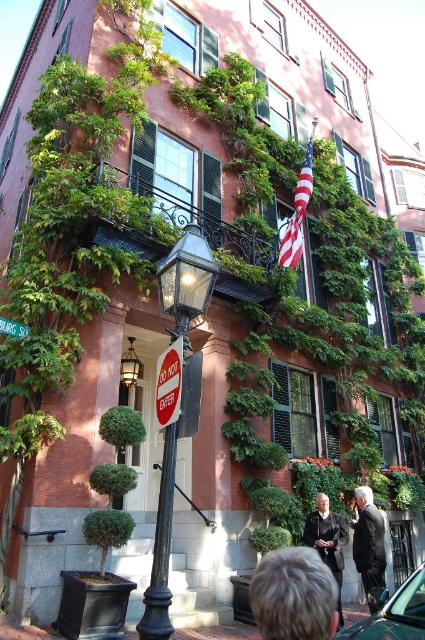
You are a pedestrian standing in front of the building. You see a dark gray suit at center and a green plastic street sign at upper left. Which object is higher up in the image?

The green plastic street sign at upper left is higher up in the image than the dark gray suit at center.

You are a window cleaner standing at the base of the building. You need to clean both the dark gray suit at center and the green plastic street sign at upper left. Which object will require you to climb higher on the ladder?

The dark gray suit at center is taller than the green plastic street sign at upper left, so you will need to climb higher on the ladder to reach the dark gray suit at center.